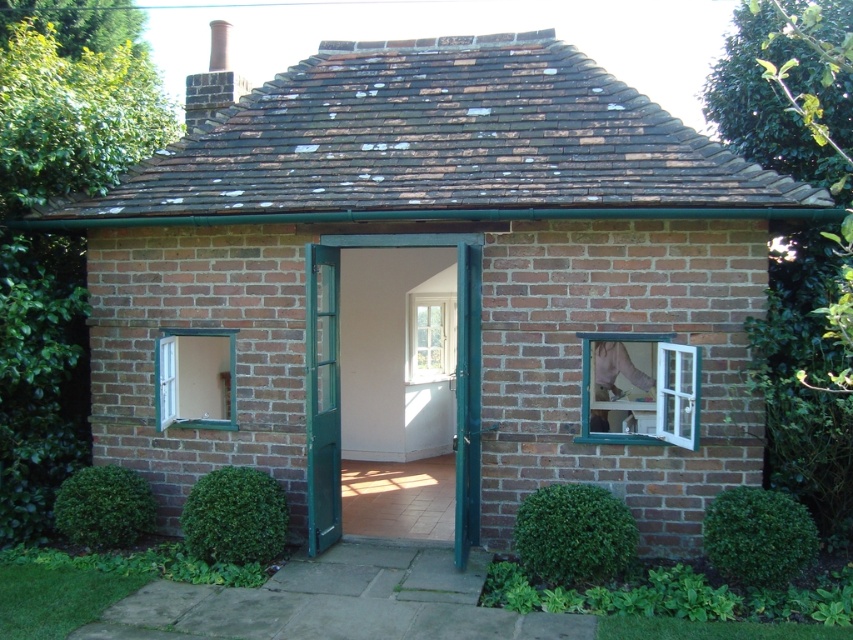
You are standing at a point 6.74 meters away from the point marked at coordinates (468, 435) on the building. The building has two windows, one closed and one open. Which window is closer to the marked point?

The open window on the right is closer to the marked point at coordinates (468, 435).

You are standing in front of the brick building and notice two plants. One is the green leafy hedge at lower center and the other is the green leafy bush at lower left. Which one is positioned to the right side from your viewpoint?

The green leafy hedge at lower center is positioned to the right of the green leafy bush at lower left.

You are standing in front of the quaint brick building and want to locate the green wood window at lower left. Based on the coordinates provided, can you determine its position relative to the entrance?

The green wood window at lower left is located at point coordinates, so it is positioned to the left side of the entrance.